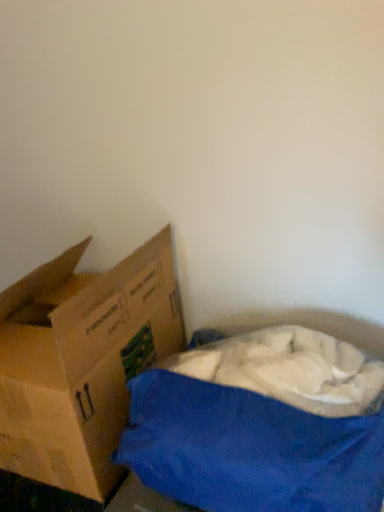
In order to face brown cardboard box at left, should I rotate leftwards or rightwards?

It's best to rotate left around 16.699 degrees.

Image resolution: width=384 pixels, height=512 pixels. Describe the element at coordinates (81, 362) in the screenshot. I see `brown cardboard box at left` at that location.

Where is `brown cardboard box at left`? This screenshot has height=512, width=384. brown cardboard box at left is located at coordinates (81, 362).

At what (x,y) coordinates should I click in order to perform the action: click on brown cardboard box at left. Please return your answer as a coordinate pair (x, y). This screenshot has width=384, height=512. Looking at the image, I should click on 81,362.